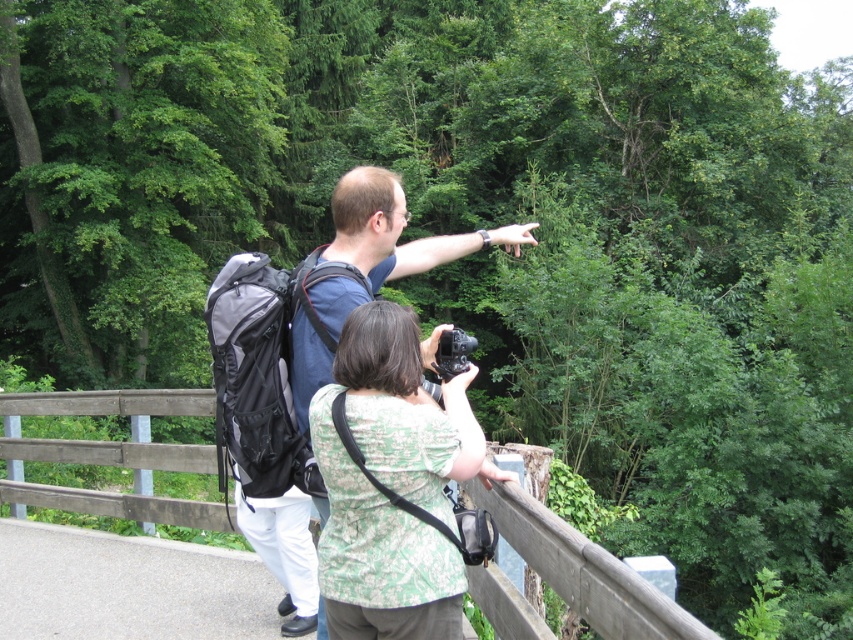
Question: Which of the following is the closest to the observer?

Choices:
 (A) wooden at upper center
 (B) matte blue shirt at center
 (C) green textured shirt at center
 (D) black plastic camera at center

Answer: (A)

Question: Does wooden at upper center have a smaller size compared to matte blue shirt at center?

Choices:
 (A) yes
 (B) no

Answer: (A)

Question: Is green textured shirt at center behind wooden at upper center?

Choices:
 (A) yes
 (B) no

Answer: (A)

Question: Estimate the real-world distances between objects in this image. Which object is farther from the black plastic camera at center?

Choices:
 (A) wooden at upper center
 (B) matte blue shirt at center

Answer: (A)

Question: Which point is closer to the camera?

Choices:
 (A) (450, 388)
 (B) (326, 364)
 (C) (131, 396)
 (D) (450, 349)

Answer: (A)

Question: From the image, what is the correct spatial relationship of green textured shirt at center in relation to black plastic camera at center?

Choices:
 (A) above
 (B) below

Answer: (B)